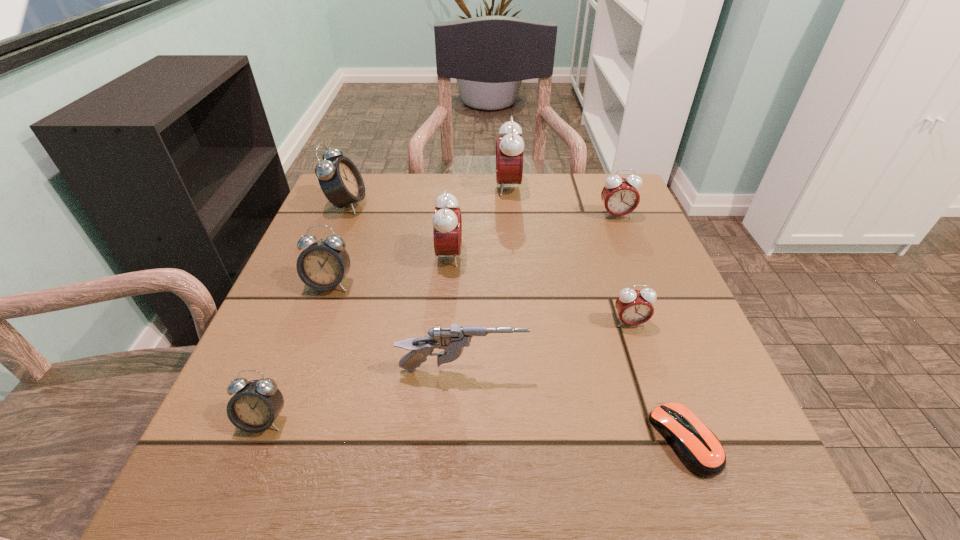
I want to click on free space at the far edge of the desktop, so [488, 188].

Identify the location of free location at the near edge. (453, 448).

At what (x,y) coordinates should I click in order to perform the action: click on vacant space at the left edge. Please return your answer as a coordinate pair (x, y). This screenshot has height=540, width=960. Looking at the image, I should click on (318, 320).

Locate an element on the screen. Image resolution: width=960 pixels, height=540 pixels. vacant space at the right edge is located at coordinates (676, 303).

At what (x,y) coordinates should I click in order to perform the action: click on vacant space at the far left corner. Please return your answer as a coordinate pair (x, y). The width and height of the screenshot is (960, 540). Looking at the image, I should click on (352, 211).

I want to click on blank space at the near left corner of the desktop, so click(x=278, y=463).

Find the location of a particular element. This screenshot has height=540, width=960. vacant area that lies between the shortest object and the biggest pink alarm clock is located at coordinates (596, 313).

Identify the location of free space between the second smallest white alarm clock and the fourth nearest object. Image resolution: width=960 pixels, height=540 pixels. (480, 303).

Locate an element on the screen. The height and width of the screenshot is (540, 960). free space between the gun and the second nearest white alarm clock is located at coordinates coord(396,327).

Where is `free space between the leftmost pink alarm clock and the second smallest pink alarm clock`? The image size is (960, 540). free space between the leftmost pink alarm clock and the second smallest pink alarm clock is located at coordinates (533, 235).